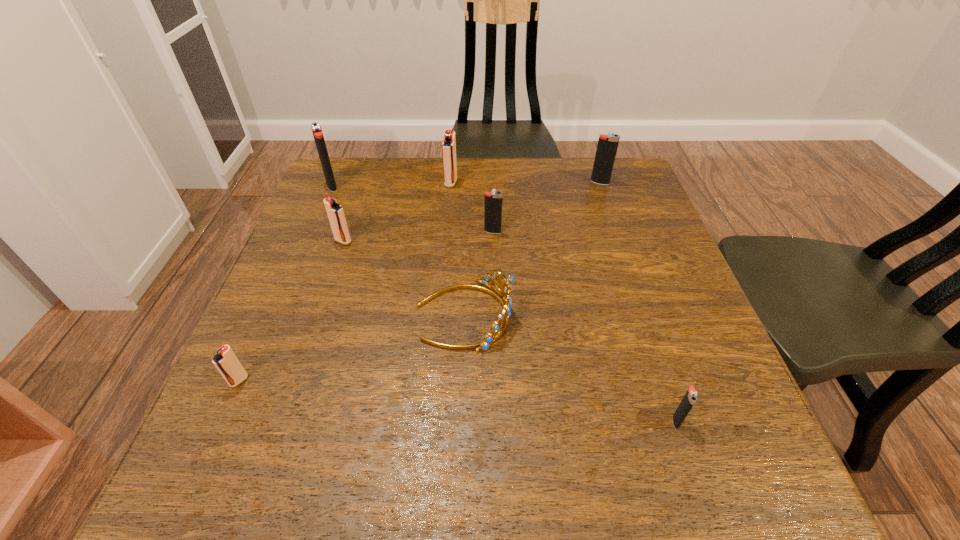
Image resolution: width=960 pixels, height=540 pixels. I want to click on the biggest black igniter, so click(x=318, y=136).

Identify the location of the leftmost black igniter. This screenshot has width=960, height=540. (318, 136).

Find the location of a particular element. the farthest red igniter is located at coordinates (449, 140).

What are the coordinates of `the fourth igniter from left to right` in the screenshot? It's located at (449, 140).

You are a GUI agent. You are given a task and a screenshot of the screen. Output one action in this format:
    pyautogui.click(x=<x>, y=<y>)
    Task: Click on the third smallest black igniter
    The image size is (960, 540).
    Given the screenshot: What is the action you would take?
    pyautogui.click(x=607, y=146)

I want to click on the second black igniter from left to right, so click(x=493, y=200).

Locate an element on the screen. This screenshot has height=540, width=960. the fifth igniter from left to right is located at coordinates (493, 200).

The height and width of the screenshot is (540, 960). Identify the location of the second smallest red igniter. (335, 212).

At what (x,y) coordinates should I click in order to perform the action: click on the sixth object from right to left. Please return your answer as a coordinate pair (x, y). This screenshot has height=540, width=960. Looking at the image, I should click on (335, 212).

I want to click on gold tiara, so click(x=505, y=300).